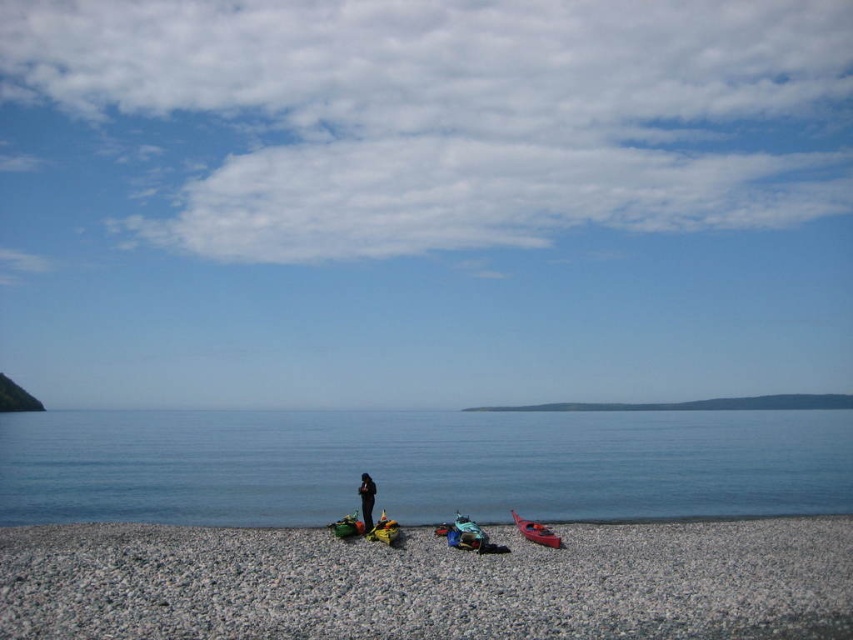
Does smooth pebble beach at lower center come behind black matte person at center?

That is False.

Who is more forward, (699, 618) or (364, 518)?

Positioned in front is point (699, 618).

Find the location of a particular element. This screenshot has width=853, height=640. smooth pebble beach at lower center is located at coordinates (428, 582).

You are a GUI agent. You are given a task and a screenshot of the screen. Output one action in this format:
    pyautogui.click(x=<x>, y=<y>)
    Task: Click on the smooth pebble beach at lower center
    The image size is (853, 640).
    Given the screenshot: What is the action you would take?
    coord(428,582)

Can you confirm if smooth pebble beach at lower center is positioned below matte red kayak at lower right?

Yes, smooth pebble beach at lower center is below matte red kayak at lower right.

The height and width of the screenshot is (640, 853). What do you see at coordinates (428, 582) in the screenshot? I see `smooth pebble beach at lower center` at bounding box center [428, 582].

Find the location of a particular element. This screenshot has width=853, height=640. smooth pebble beach at lower center is located at coordinates (428, 582).

Identify the location of smooth pebble beach at lower center. The height and width of the screenshot is (640, 853). (428, 582).

Is blue smooth water at center below black matte person at center?

Correct, blue smooth water at center is located below black matte person at center.

Is point (177, 508) more distant than point (361, 509)?

Yes, it is.

Identify the location of blue smooth water at center. (418, 465).